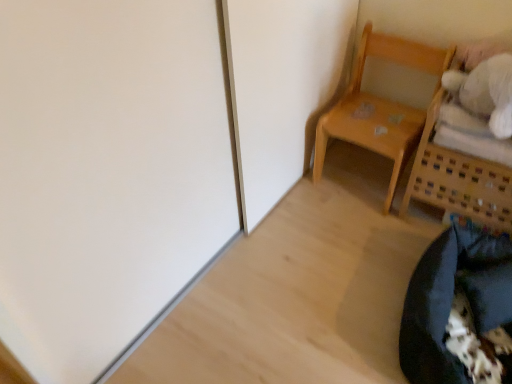
Identify the location of free space between light wood chair at upper right, which is the second furniture in right-to-left order, and black fabric bean bag chair at lower right. (365, 251).